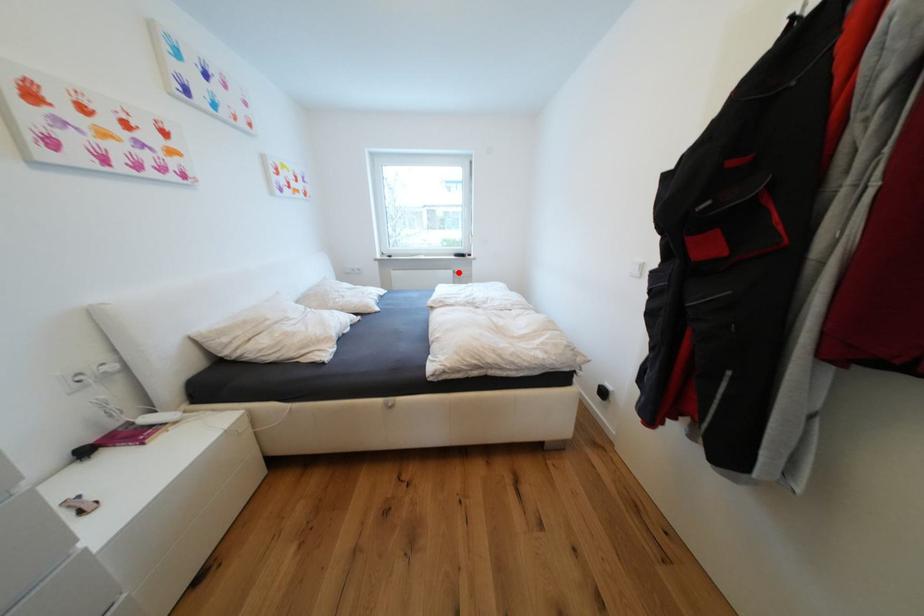
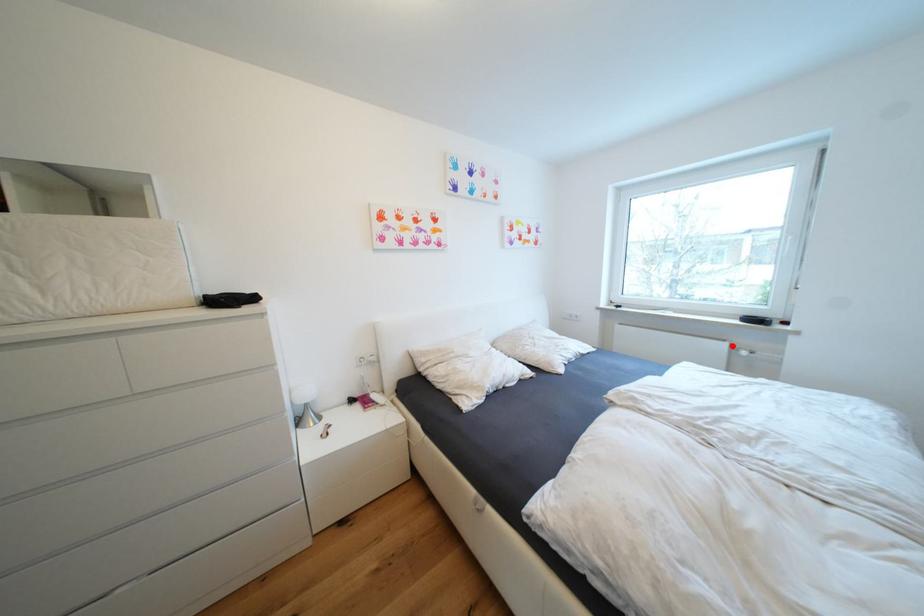
I am providing you with two images of the same scene from different viewpoints. A red point is marked on the first image and another point is marked on the second image. Is the red point in image1 aligned with the point shown in image2?

Yes